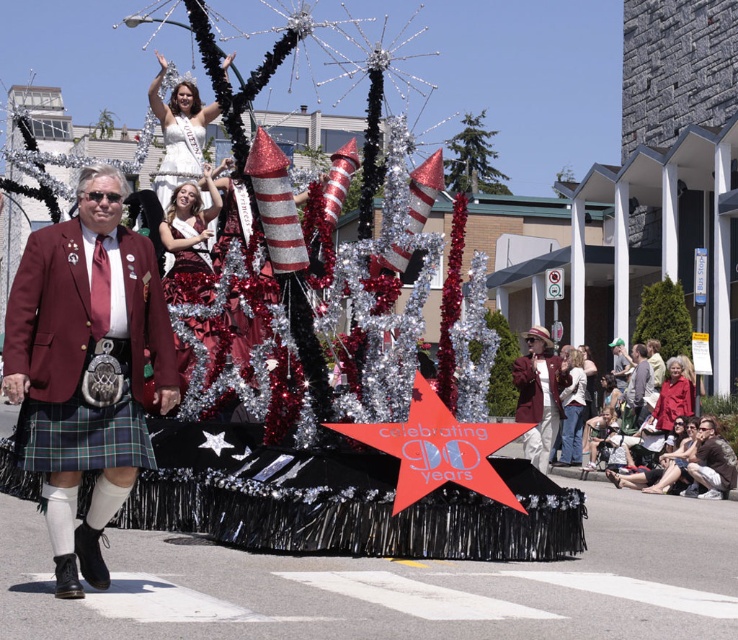
You are a photographer at the parade and want to capture both the green fabric cap at upper center and the matte white blouse at center in a single shot. Which object should you focus on first to ensure both are in frame?

The green fabric cap at upper center is positioned over the matte white blouse at center, so focusing on the green fabric cap at upper center first will ensure both are in the frame.

You are a photographer standing at the center of the parade route. You want to take a photo that includes both the point at coordinates point (531, 376) and point (627, 385). Which point should you focus on first to ensure both are in focus?

You should focus on point (531, 376) first because it is closer to the camera than point (627, 385). This ensures that both points will be in focus as the depth of field will cover the distance between them.

You are a photographer at the parade and want to capture both the maroon fabric jacket at center and the green fabric jacket at lower right in the same photo. Which direction should you move your camera to include both jackets?

→ To include both the maroon fabric jacket at center and the green fabric jacket at lower right, you should move your camera to the left since the maroon fabric jacket at center is to the left of the green fabric jacket at lower right.